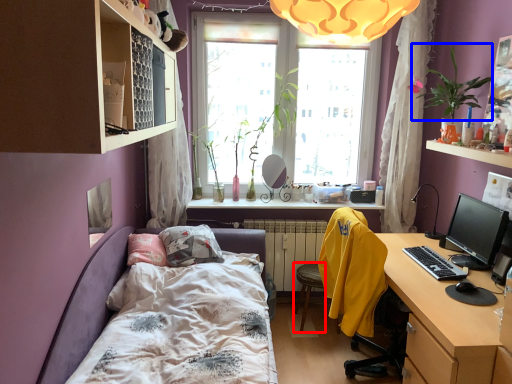
Question: Which of the following is the farthest to the observer, computer (highlighted by a red box) or plant (highlighted by a blue box)?

Choices:
 (A) computer
 (B) plant

Answer: (A)